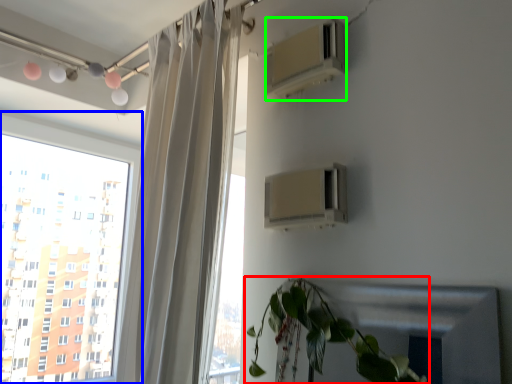
Question: Which object is the closest to the houseplant (highlighted by a red box)? Choose among these: window (highlighted by a blue box) or air conditioning (highlighted by a green box).

Choices:
 (A) window
 (B) air conditioning

Answer: (B)